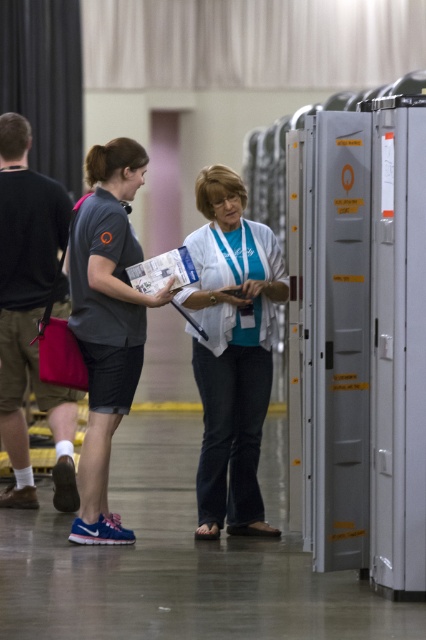
You are a photographer trying to capture a candid shot of the two women in the scene. Since you want to include both subjects in the frame, which direction should you position yourself relative to the white matte shirt at center and the matte gray shirt at center?

You should position yourself to the left of both subjects because the white matte shirt at center is to the right of the matte gray shirt at center, so standing to the left would allow you to capture both in the frame.

You are a photographer standing at the center of the hall. You want to take a photo that includes both the point at coordinates point (245, 221) and point (11, 499). Which point should you focus on first to ensure both are in focus?

You should focus on point (245, 221) first because it is closer to the camera than point (11, 499), ensuring both are within the depth of field.

You are standing at the origin point in the center of the image. A person wearing a white matte shirt is located at coordinates given. In which direction relative to you is the white matte shirt at center located?

The white matte shirt at center is located at coordinates approximately 0.548 on the x and 0.545 on the y axis, which is slightly to the right and slightly above the center point.